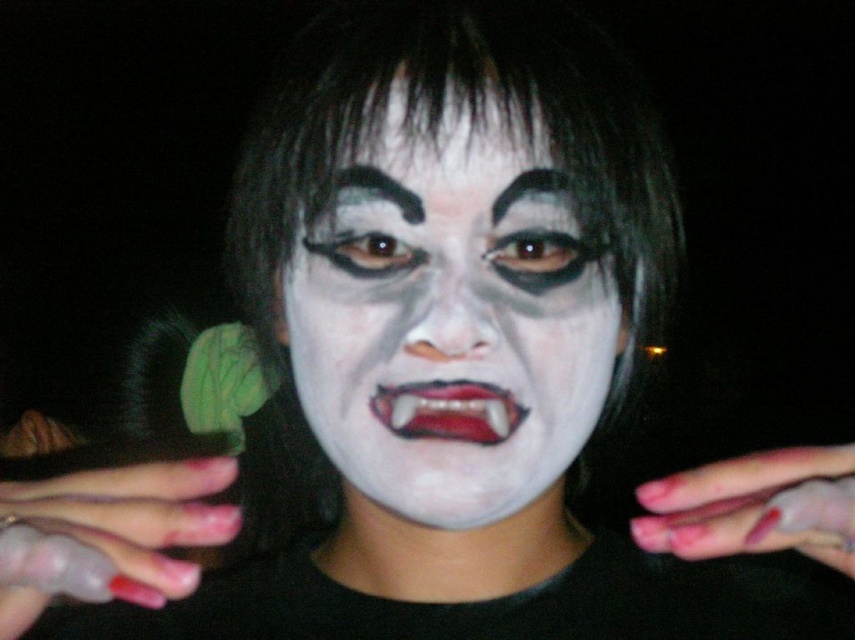
You are a makeup artist preparing for a Halloween event. You need to apply the white matte face at center and the pink matte nails at center. Based on the image, which object is positioned to the left of the other?

The white matte face at center is positioned to the left of the pink matte nails at center.

You are a photographer setting up a Halloween photoshoot. You need to ensure that the pink matte nails at center and the white matte face at center are both visible in the final shot. Based on their positions, which object should you focus on to capture both clearly?

To capture both the pink matte nails at center and the white matte face at center clearly, you should focus on the white matte face at center because the pink matte nails at center is behind it. By focusing on the front object, the face, the nails in the background will still be in focus due to depth of field, ensuring both are visible.

You are a photographer adjusting your camera settings to focus on the subject in the image. The camera has a focus point at point (449, 321). What part of the subject is the focus point targeting?

The focus point at point (449, 321) is targeting the white matte face at center.